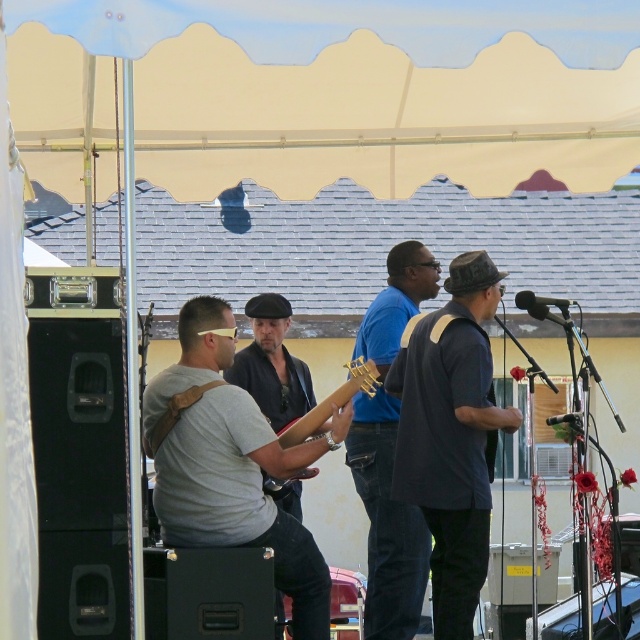
Question: Which object is the closest to the dark blue shirt at center?

Choices:
 (A) matte brown guitar at center
 (B) wooden acoustic guitar at center
 (C) gray fabric guitar at center
 (D) blue matte guitar at center

Answer: (B)

Question: Does dark blue shirt at center appear on the right side of blue matte guitar at center?

Choices:
 (A) yes
 (B) no

Answer: (A)

Question: Which object is the farthest from the dark blue shirt at center?

Choices:
 (A) matte black guitar at center
 (B) gray fabric guitar at center
 (C) blue matte guitar at center
 (D) wooden acoustic guitar at center

Answer: (A)

Question: Is dark blue shirt at center above wooden acoustic guitar at center?

Choices:
 (A) no
 (B) yes

Answer: (A)

Question: Does gray fabric guitar at center appear under wooden acoustic guitar at center?

Choices:
 (A) yes
 (B) no

Answer: (A)

Question: Based on their relative distances, which object is farther from the gray fabric guitar at center?

Choices:
 (A) dark blue shirt at center
 (B) matte brown guitar at center
 (C) wooden acoustic guitar at center

Answer: (A)